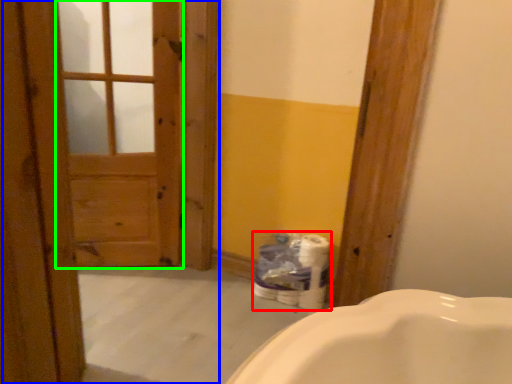
Question: Which object is the closest to the toilet paper (highlighted by a red box)? Choose among these: barn door (highlighted by a blue box) or screen door (highlighted by a green box).

Choices:
 (A) barn door
 (B) screen door

Answer: (A)